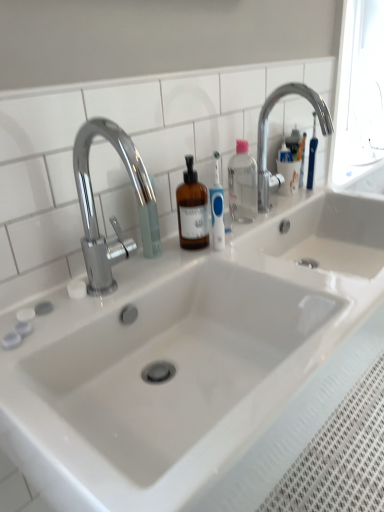
Identify the location of vacant area that lies to the right of chrome metallic faucet at left, which is counted as the second tap, starting from the right. (215, 265).